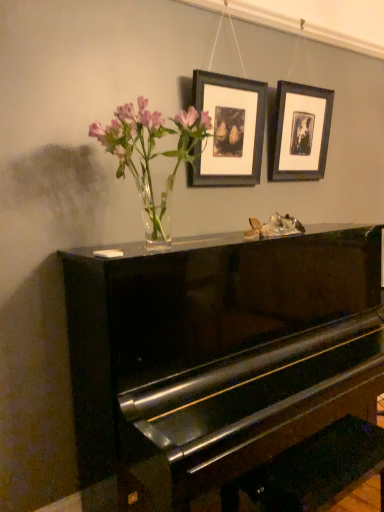
Identify the location of clear glass vase at upper center. (151, 152).

Describe the element at coordinates (229, 130) in the screenshot. Image resolution: width=384 pixels, height=512 pixels. I see `matte black picture frame at upper center, the 2th picture frame positioned from the back` at that location.

You are a GUI agent. You are given a task and a screenshot of the screen. Output one action in this format:
    pyautogui.click(x=<x>, y=<y>)
    Task: Click on the matte black picture frame at upper right, the 1th picture frame when ordered from right to left
    The height and width of the screenshot is (512, 384).
    Given the screenshot: What is the action you would take?
    301,131

Can you tell me how much clear glass vase at upper center and matte black picture frame at upper center, acting as the first picture frame starting from the left, differ in facing direction?

0.931 degrees separate the facing orientations of clear glass vase at upper center and matte black picture frame at upper center, acting as the first picture frame starting from the left.

Looking at this image, from the image's perspective, is clear glass vase at upper center beneath matte black picture frame at upper center, marked as the second picture frame in a right-to-left arrangement?

Yes, from the image's perspective, clear glass vase at upper center is below matte black picture frame at upper center, marked as the second picture frame in a right-to-left arrangement.

Between clear glass vase at upper center and matte black picture frame at upper center, the 2th picture frame positioned from the back, which one appears on the right side from the viewer's perspective?

matte black picture frame at upper center, the 2th picture frame positioned from the back, is more to the right.

How distant is clear glass vase at upper center from matte black picture frame at upper center, the first picture frame from the front?

clear glass vase at upper center and matte black picture frame at upper center, the first picture frame from the front, are 10.32 inches apart from each other.

Considering the sizes of matte black picture frame at upper center, marked as the second picture frame in a right-to-left arrangement, and matte black picture frame at upper right, acting as the 1th picture frame starting from the back, in the image, is matte black picture frame at upper center, marked as the second picture frame in a right-to-left arrangement, bigger or smaller than matte black picture frame at upper right, acting as the 1th picture frame starting from the back,?

matte black picture frame at upper center, marked as the second picture frame in a right-to-left arrangement, is smaller than matte black picture frame at upper right, acting as the 1th picture frame starting from the back.

Is matte black picture frame at upper center, the first picture frame from the front, far away from matte black picture frame at upper right, acting as the 1th picture frame starting from the back?

No.

Is matte black picture frame at upper center, the 2th picture frame positioned from the back, positioned with its back to matte black picture frame at upper right, marked as the second picture frame in a left-to-right arrangement?

No.

Which is correct: matte black picture frame at upper center, the first picture frame from the front, is inside glossy black piano at center, or outside of it?

matte black picture frame at upper center, the first picture frame from the front, is not inside glossy black piano at center, it's outside.

Could you tell me if matte black picture frame at upper center, marked as the second picture frame in a right-to-left arrangement, is turned towards glossy black piano at center?

No, matte black picture frame at upper center, marked as the second picture frame in a right-to-left arrangement, is not aimed at glossy black piano at center.

From a real-world perspective, who is located lower, matte black picture frame at upper center, marked as the second picture frame in a right-to-left arrangement, or glossy black piano at center?

In real-world perspective, glossy black piano at center is lower.

In the scene shown: Is matte black picture frame at upper center, the first picture frame from the front, bigger than glossy black piano at center?

Actually, matte black picture frame at upper center, the first picture frame from the front, might be smaller than glossy black piano at center.

Would you consider matte black picture frame at upper right, acting as the 1th picture frame starting from the back, to be distant from matte black picture frame at upper center, the 2th picture frame positioned from the back?

No, matte black picture frame at upper right, acting as the 1th picture frame starting from the back, is not far away from matte black picture frame at upper center, the 2th picture frame positioned from the back.

Is matte black picture frame at upper right, acting as the 1th picture frame starting from the back, not inside matte black picture frame at upper center, marked as the second picture frame in a right-to-left arrangement?

matte black picture frame at upper right, acting as the 1th picture frame starting from the back, lies outside matte black picture frame at upper center, marked as the second picture frame in a right-to-left arrangement,'s area.

Based on the photo, is matte black picture frame at upper right, the 2th picture frame positioned from the front, smaller than matte black picture frame at upper center, acting as the first picture frame starting from the left?

Actually, matte black picture frame at upper right, the 2th picture frame positioned from the front, might be larger than matte black picture frame at upper center, acting as the first picture frame starting from the left.

Which object is wider, matte black picture frame at upper right, marked as the second picture frame in a left-to-right arrangement, or matte black picture frame at upper center, marked as the second picture frame in a right-to-left arrangement?

Wider between the two is matte black picture frame at upper right, marked as the second picture frame in a left-to-right arrangement.

Do you think matte black picture frame at upper center, the 2th picture frame positioned from the back, is within clear glass vase at upper center, or outside of it?

matte black picture frame at upper center, the 2th picture frame positioned from the back, exists outside the volume of clear glass vase at upper center.

Where is `the 1st picture frame above the clear glass vase at upper center (from a real-world perspective)`? the 1st picture frame above the clear glass vase at upper center (from a real-world perspective) is located at coordinates (229, 130).

Is matte black picture frame at upper center, marked as the second picture frame in a right-to-left arrangement, looking in the opposite direction of clear glass vase at upper center?

That's not correct — matte black picture frame at upper center, marked as the second picture frame in a right-to-left arrangement, is not looking away from clear glass vase at upper center.

From the picture: From a real-world perspective, is matte black picture frame at upper center, the 2th picture frame positioned from the back, physically below clear glass vase at upper center?

No, from a real-world perspective, matte black picture frame at upper center, the 2th picture frame positioned from the back, is not under clear glass vase at upper center.

Is glossy black piano at center not close to matte black picture frame at upper right, acting as the 1th picture frame starting from the back?

No, glossy black piano at center is not far away from matte black picture frame at upper right, acting as the 1th picture frame starting from the back.

Considering the relative sizes of glossy black piano at center and matte black picture frame at upper right, the 1th picture frame when ordered from right to left, in the image provided, is glossy black piano at center taller than matte black picture frame at upper right, the 1th picture frame when ordered from right to left,?

Yes, glossy black piano at center is taller than matte black picture frame at upper right, the 1th picture frame when ordered from right to left.

From a real-world perspective, between glossy black piano at center and matte black picture frame at upper right, marked as the second picture frame in a left-to-right arrangement, who is vertically higher?

matte black picture frame at upper right, marked as the second picture frame in a left-to-right arrangement, is physically above.

From a real-world perspective, is clear glass vase at upper center physically below glossy black piano at center?

No, from a real-world perspective, clear glass vase at upper center is not below glossy black piano at center.

How many degrees apart are the facing directions of clear glass vase at upper center and glossy black piano at center?

0.65 degrees.

From the image's perspective, is clear glass vase at upper center beneath glossy black piano at center?

No, from the image's perspective, clear glass vase at upper center is not beneath glossy black piano at center.

Is clear glass vase at upper center bigger than glossy black piano at center?

No.

This screenshot has width=384, height=512. I want to click on floral arrangement below the matte black picture frame at upper center, marked as the second picture frame in a right-to-left arrangement (from the image's perspective), so click(151, 152).

Locate an element on the screen. This screenshot has width=384, height=512. picture frame that is behind the matte black picture frame at upper center, the first picture frame from the front is located at coordinates (301, 131).

When comparing their distances from clear glass vase at upper center, does matte black picture frame at upper right, the 2th picture frame positioned from the front, or glossy black piano at center seem further?

Among the two, matte black picture frame at upper right, the 2th picture frame positioned from the front, is located further to clear glass vase at upper center.

When comparing their distances from glossy black piano at center, does clear glass vase at upper center or matte black picture frame at upper center, the first picture frame from the front, seem further?

matte black picture frame at upper center, the first picture frame from the front, is positioned further to the anchor glossy black piano at center.

When comparing their distances from matte black picture frame at upper right, acting as the 1th picture frame starting from the back, does matte black picture frame at upper center, the first picture frame from the front, or clear glass vase at upper center seem further?

Based on the image, clear glass vase at upper center appears to be further to matte black picture frame at upper right, acting as the 1th picture frame starting from the back.

Which object lies nearer to the anchor point matte black picture frame at upper center, the 2th picture frame positioned from the back, matte black picture frame at upper right, the 2th picture frame positioned from the front, or glossy black piano at center?

matte black picture frame at upper right, the 2th picture frame positioned from the front.

Considering their positions, is clear glass vase at upper center positioned closer to matte black picture frame at upper center, the first picture frame from the front, than glossy black piano at center?

The object closer to matte black picture frame at upper center, the first picture frame from the front, is clear glass vase at upper center.

Looking at the image, which one is located closer to clear glass vase at upper center, glossy black piano at center or matte black picture frame at upper right, the 2th picture frame positioned from the front?

Among the two, glossy black piano at center is located nearer to clear glass vase at upper center.

Looking at the image, which one is located further to glossy black piano at center, clear glass vase at upper center or matte black picture frame at upper right, acting as the 1th picture frame starting from the back?

The object further to glossy black piano at center is matte black picture frame at upper right, acting as the 1th picture frame starting from the back.

From the image, which object appears to be nearer to matte black picture frame at upper right, the 1th picture frame when ordered from right to left, clear glass vase at upper center or glossy black piano at center?

clear glass vase at upper center lies closer to matte black picture frame at upper right, the 1th picture frame when ordered from right to left, than the other object.

Locate an element on the screen. This screenshot has height=512, width=384. picture frame between matte black picture frame at upper right, the 1th picture frame when ordered from right to left, and glossy black piano at center in the up-down direction is located at coordinates click(x=229, y=130).

Find the location of a particular element. picture frame between clear glass vase at upper center and matte black picture frame at upper right, the 1th picture frame when ordered from right to left, from front to back is located at coordinates (229, 130).

Image resolution: width=384 pixels, height=512 pixels. Find the location of `floral arrangement between matte black picture frame at upper right, marked as the second picture frame in a left-to-right arrangement, and glossy black piano at center vertically`. floral arrangement between matte black picture frame at upper right, marked as the second picture frame in a left-to-right arrangement, and glossy black piano at center vertically is located at coordinates (151, 152).

Locate an element on the screen. This screenshot has height=512, width=384. floral arrangement between matte black picture frame at upper center, acting as the first picture frame starting from the left, and glossy black piano at center vertically is located at coordinates (151, 152).